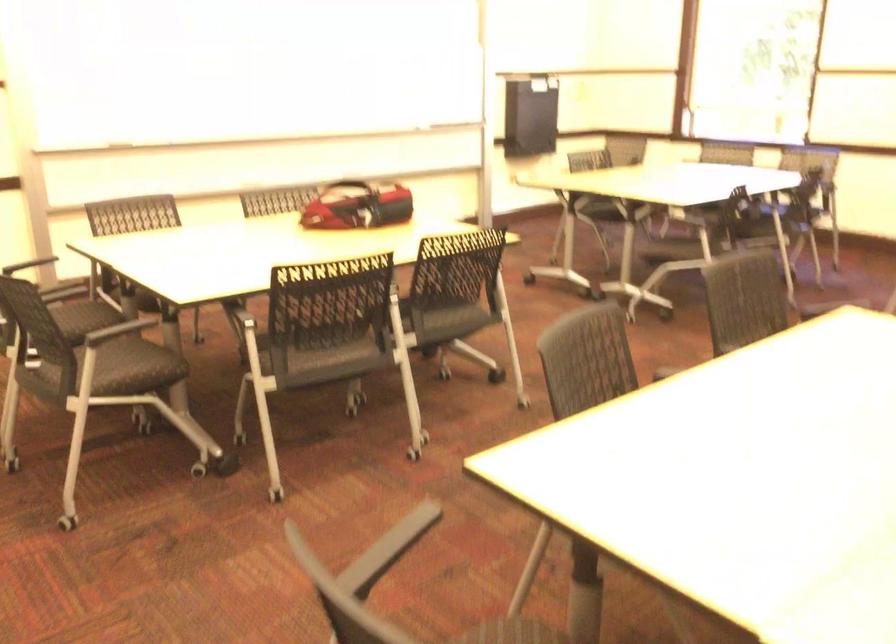
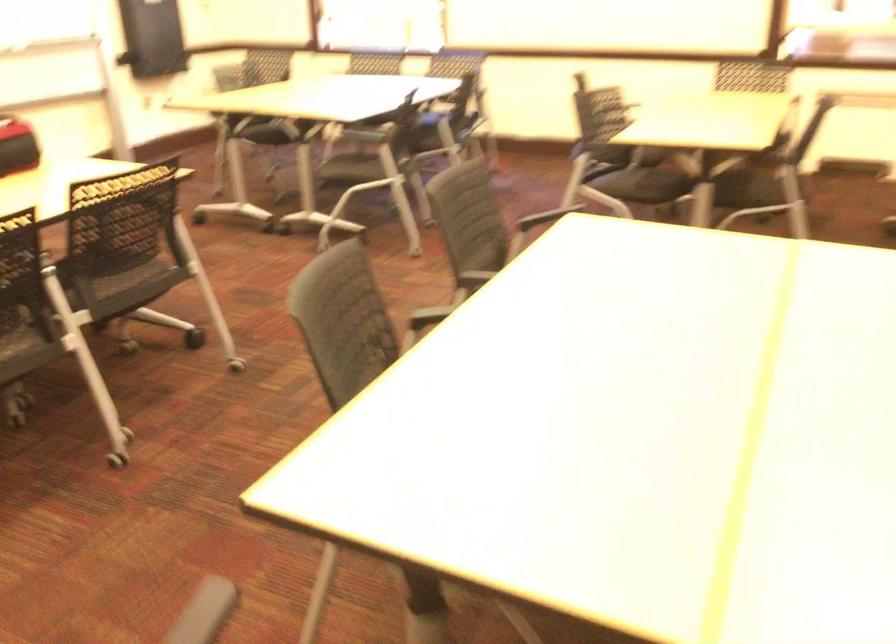
Question: The images are taken continuously from a first-person perspective. In which direction are you moving?

Choices:
 (A) Left
 (B) Right
 (C) Forward
 (D) Backward

Answer: (C)